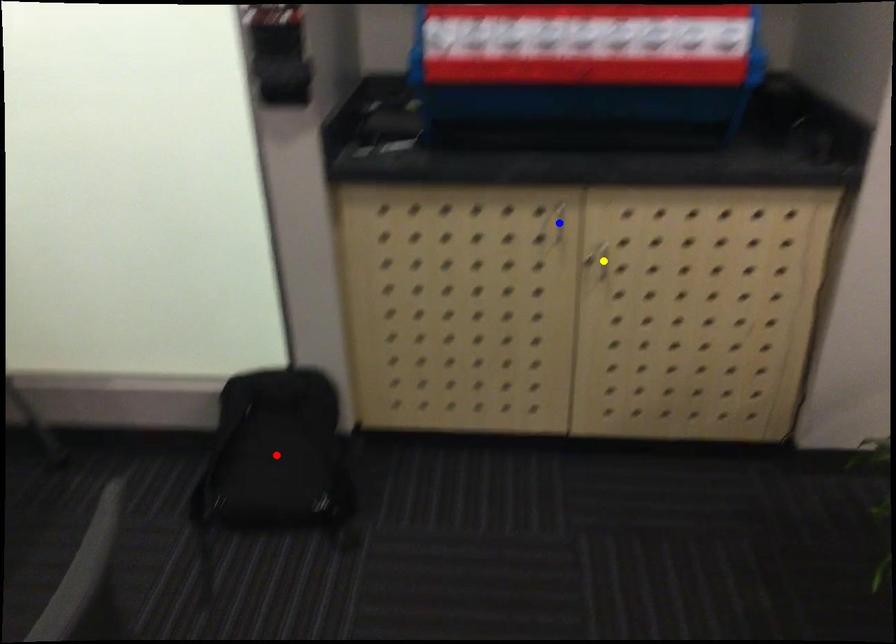
Order these from nearest to farthest:
- red point
- blue point
- yellow point

1. blue point
2. yellow point
3. red point